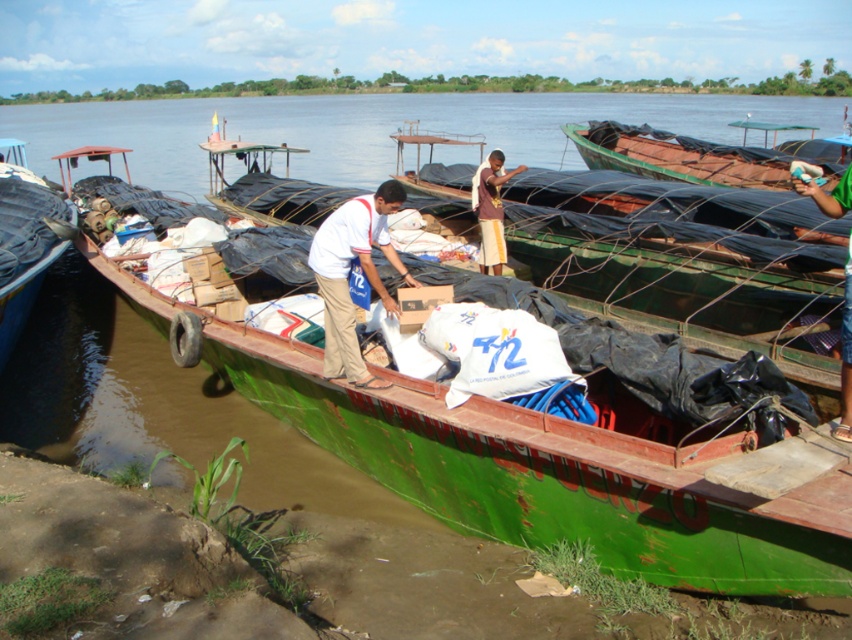
Question: In this image, where is white cotton shirt at center located relative to green wooden boat at upper right?

Choices:
 (A) right
 (B) left

Answer: (B)

Question: Among these objects, which one is farthest from the camera?

Choices:
 (A) white cotton shirt at center
 (B) blue tarpaulin boat at left

Answer: (B)

Question: Is white cotton shirt at center smaller than brown woven cloth at center?

Choices:
 (A) no
 (B) yes

Answer: (A)

Question: Is green fabric shirt at upper right above brown woven cloth at center?

Choices:
 (A) yes
 (B) no

Answer: (B)

Question: Which of the following is the closest to the observer?

Choices:
 (A) green fabric shirt at upper right
 (B) blue tarpaulin boat at left
 (C) white cotton shirt at center

Answer: (A)

Question: Which point is farther to the camera?

Choices:
 (A) green wooden boat at upper right
 (B) green fabric shirt at upper right

Answer: (A)